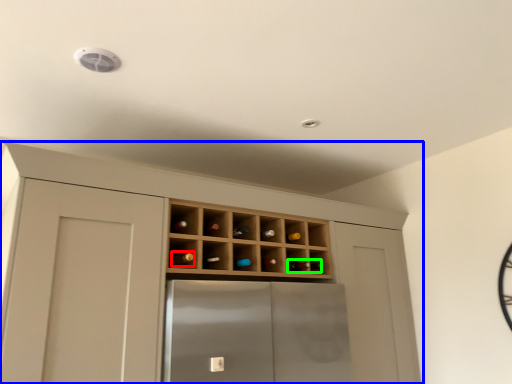
Question: Estimate the real-world distances between objects in this image. Which object is closer to wine bottle (highlighted by a red box), cupboard (highlighted by a blue box) or wine bottle (highlighted by a green box)?

Choices:
 (A) cupboard
 (B) wine bottle

Answer: (B)